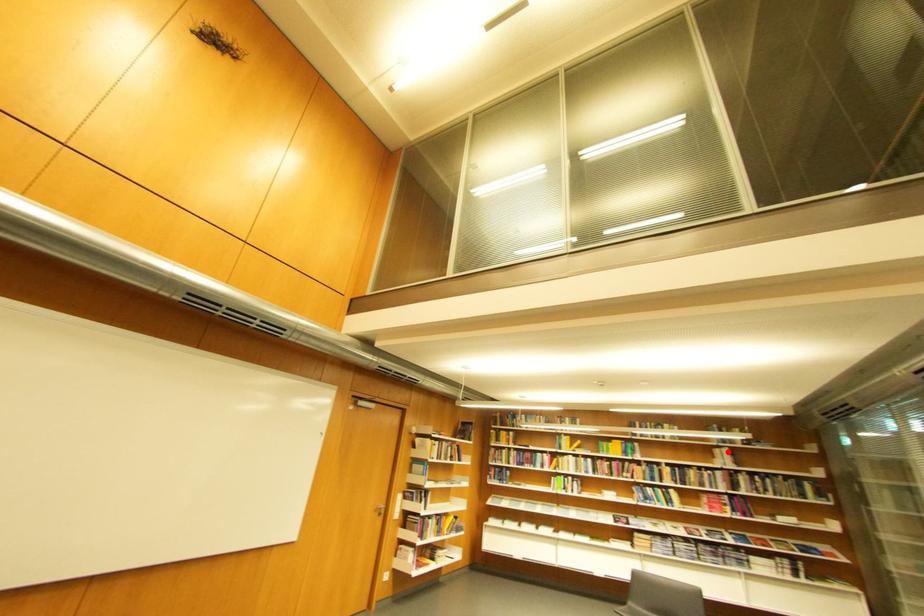
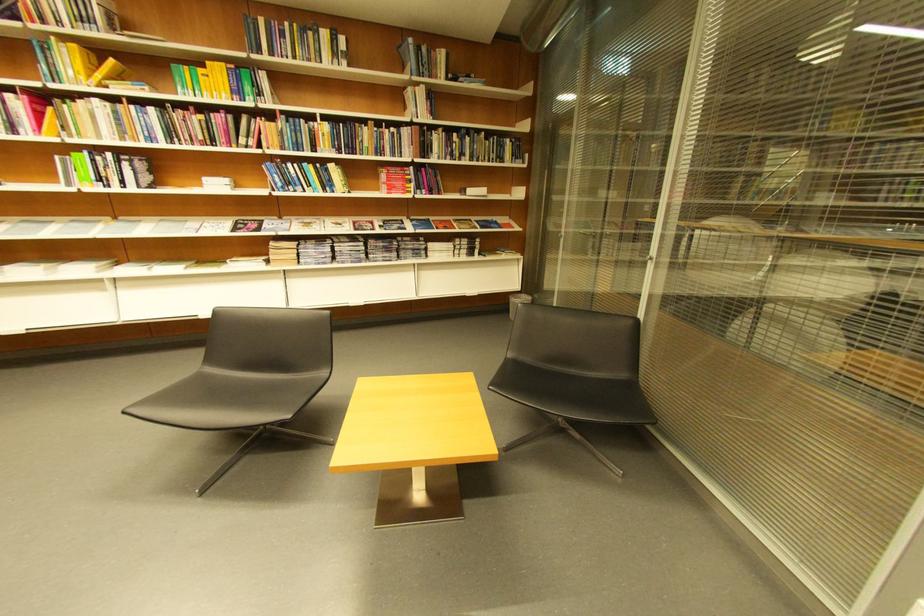
Locate, in the second image, the point that corresponds to the highlighted location in the first image.

(419, 91)